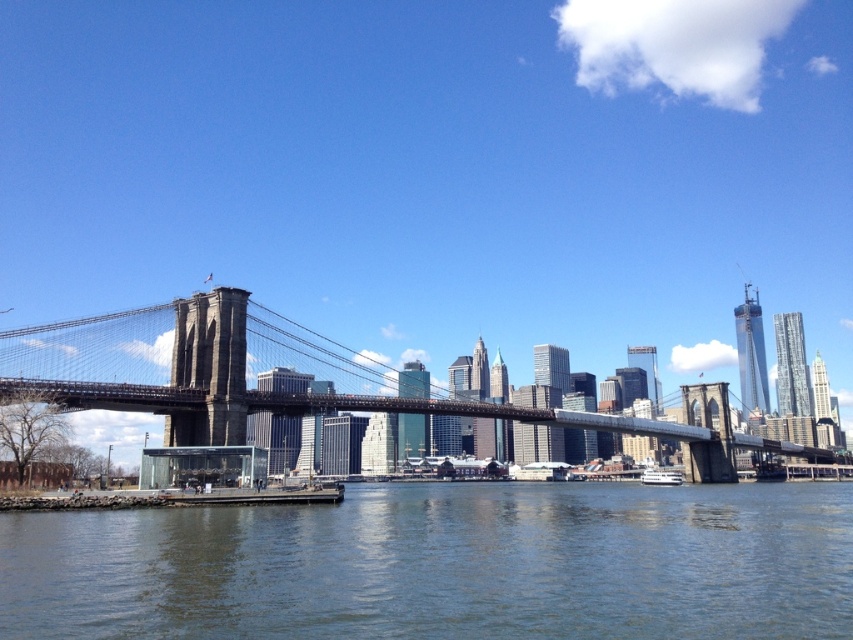
Question: From the image, what is the correct spatial relationship of dark gray steel suspension bridge at center in relation to white glossy boat at lower center?

Choices:
 (A) above
 (B) below

Answer: (A)

Question: Which of these objects is positioned farthest from the white glossy boat at lower center?

Choices:
 (A) dark gray steel suspension bridge at center
 (B) greenish-blue water at lower center

Answer: (A)

Question: Which point is closer to the camera?

Choices:
 (A) white glossy boat at lower center
 (B) dark gray steel suspension bridge at center

Answer: (B)

Question: Is greenish-blue water at lower center below dark gray steel suspension bridge at center?

Choices:
 (A) yes
 (B) no

Answer: (A)

Question: Among these objects, which one is farthest from the camera?

Choices:
 (A) white glossy boat at lower center
 (B) greenish-blue water at lower center

Answer: (A)

Question: Can you confirm if dark gray steel suspension bridge at center is wider than white glossy boat at lower center?

Choices:
 (A) no
 (B) yes

Answer: (B)